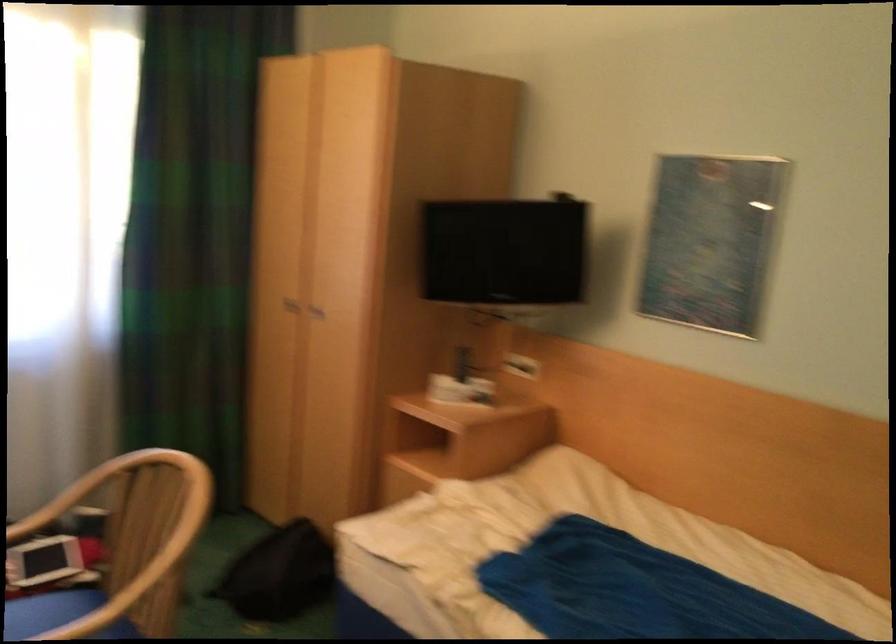
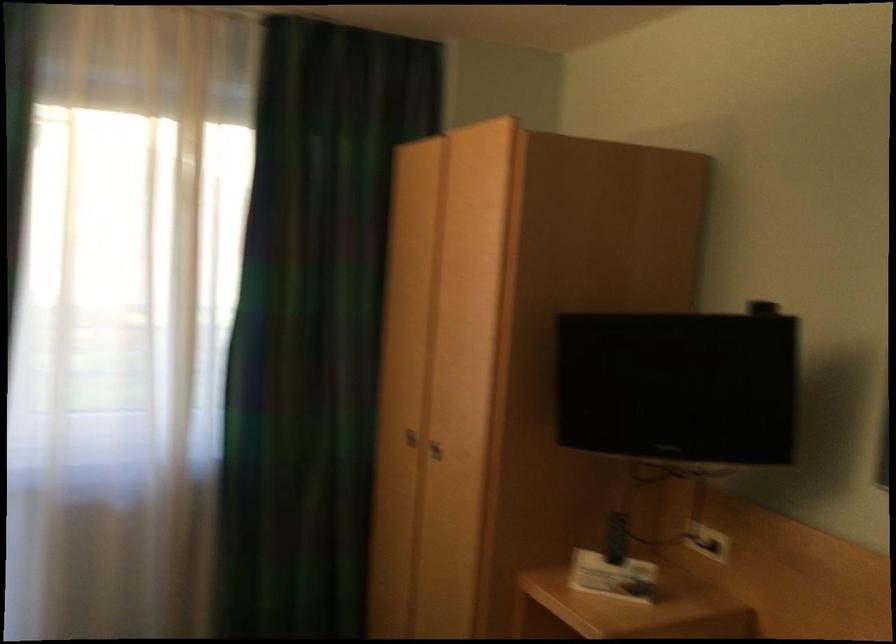
Locate, in the second image, the point that corresponds to [522,364] in the first image.

(707, 542)